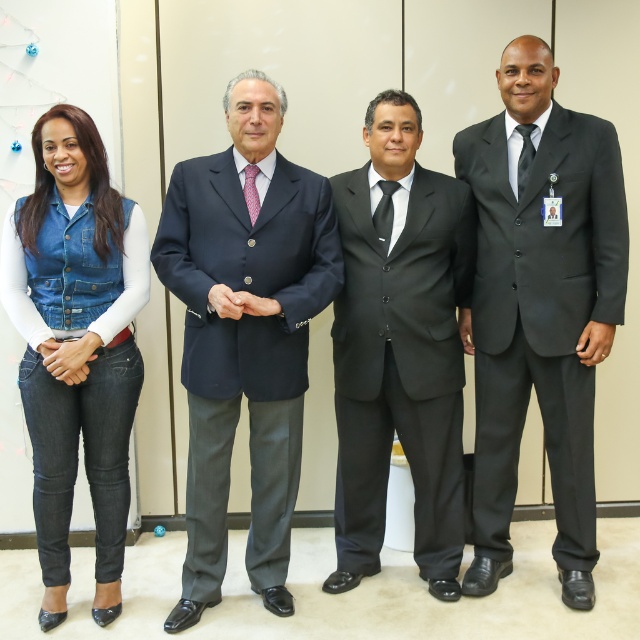
Does navy blue suit at center have a larger size compared to denim vest at left?

Yes.

The height and width of the screenshot is (640, 640). What do you see at coordinates (244, 333) in the screenshot?
I see `navy blue suit at center` at bounding box center [244, 333].

Identify the location of navy blue suit at center. (244, 333).

Is point (273, 204) more distant than point (445, 444)?

No.

Which of these two, navy blue suit at center or black satin suit at center, stands taller?

With more height is navy blue suit at center.

Is point (221, 211) positioned in front of point (417, 518)?

Yes, point (221, 211) is closer to viewer.

Image resolution: width=640 pixels, height=640 pixels. What are the coordinates of `navy blue suit at center` in the screenshot? It's located at (244, 333).

Can you confirm if matte black suit at right is shorter than navy blue suit at center?

No, matte black suit at right is not shorter than navy blue suit at center.

Consider the image. Is the position of matte black suit at right more distant than that of navy blue suit at center?

That is True.

Is point (568, 516) positioned after point (193, 486)?

Yes.

Identify the location of matte black suit at right. (540, 305).